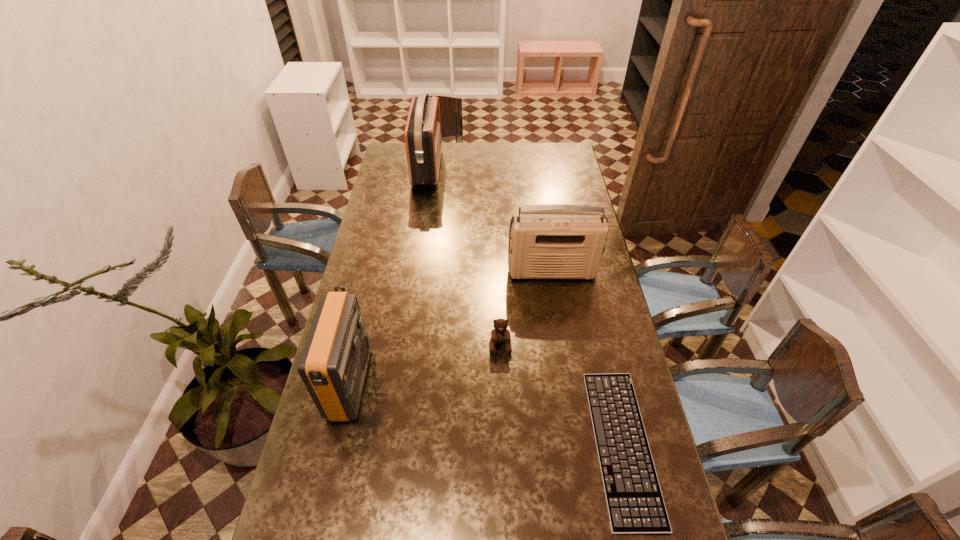
This screenshot has width=960, height=540. What are the coordinates of `vacant space that is in between the computer keyboard and the fourth tallest object` in the screenshot? It's located at (561, 395).

In order to click on object that is the fourth closest to the second shortest object in this screenshot , I will do `click(423, 141)`.

Select which object is the third closest to the computer keyboard. Please provide its 2D coordinates. Your answer should be formatted as a tuple, i.e. [(x, y)], where the tuple contains the x and y coordinates of a point satisfying the conditions above.

[(333, 365)]

The width and height of the screenshot is (960, 540). I want to click on the second closest radio receiver to the leftmost radio receiver, so click(x=423, y=141).

Find the location of a particular element. The image size is (960, 540). radio receiver that stands as the second closest to the farthest object is located at coordinates (333, 365).

I want to click on vacant point that satisfies the following two spatial constraints: 1. on the face of the computer keyboard; 2. on the left side of the teddy bear, so click(x=504, y=445).

Find the location of a particular element. This screenshot has height=540, width=960. free space that satisfies the following two spatial constraints: 1. on the back side of the computer keyboard; 2. on the front-facing side of the nearest radio receiver is located at coordinates (608, 384).

Image resolution: width=960 pixels, height=540 pixels. I want to click on vacant space that satisfies the following two spatial constraints: 1. on the front-facing side of the leftmost object; 2. on the left side of the shortest object, so click(x=336, y=445).

The width and height of the screenshot is (960, 540). In order to click on free space that satisfies the following two spatial constraints: 1. on the front-facing side of the farthest object; 2. on the left side of the computer keyboard in this screenshot , I will do `click(385, 445)`.

In order to click on vacant space that satisfies the following two spatial constraints: 1. on the front-facing side of the shortest object; 2. on the left side of the second radio receiver from left to right in this screenshot , I will do `click(385, 445)`.